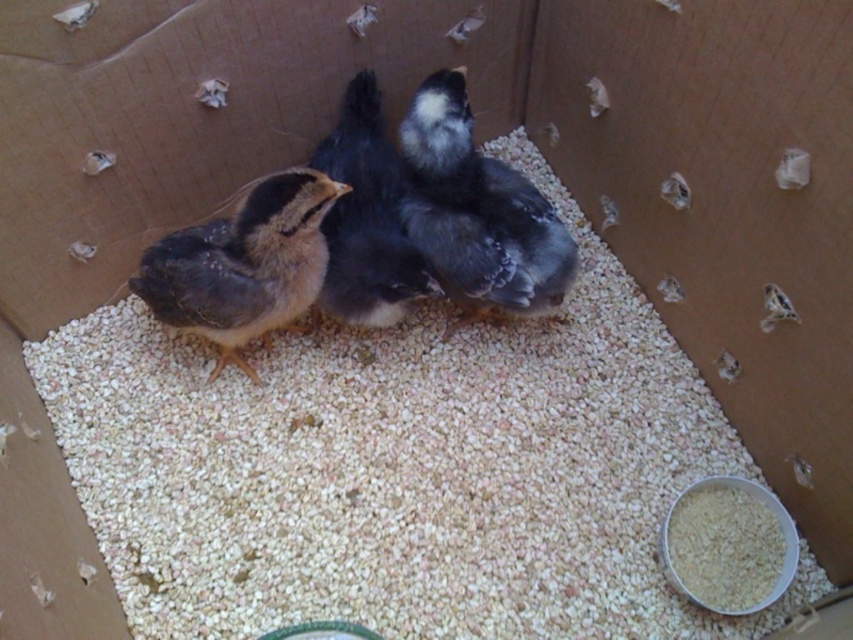
Who is higher up, silvery gray feathers at center or white grain at lower right?

Positioned higher is silvery gray feathers at center.

Which of these two, silvery gray feathers at center or white grain at lower right, stands shorter?

With less height is white grain at lower right.

Locate an element on the screen. This screenshot has width=853, height=640. silvery gray feathers at center is located at coordinates (479, 211).

The width and height of the screenshot is (853, 640). Find the location of `silvery gray feathers at center`. silvery gray feathers at center is located at coordinates (479, 211).

Can you confirm if soft yellow down at center is shorter than white grain at lower right?

In fact, soft yellow down at center may be taller than white grain at lower right.

In the scene shown: Can you confirm if soft yellow down at center is positioned above white grain at lower right?

Correct, soft yellow down at center is located above white grain at lower right.

This screenshot has width=853, height=640. Describe the element at coordinates (242, 264) in the screenshot. I see `soft yellow down at center` at that location.

You are a GUI agent. You are given a task and a screenshot of the screen. Output one action in this format:
    pyautogui.click(x=<x>, y=<y>)
    Task: Click on the soft yellow down at center
    This screenshot has height=640, width=853.
    Given the screenshot: What is the action you would take?
    pyautogui.click(x=242, y=264)

Is silvery gray feathers at center bigger than black feathered chick at center?

No.

Is silvery gray feathers at center positioned before black feathered chick at center?

Yes, silvery gray feathers at center is closer to the viewer.

Between point (463, 244) and point (376, 131), which one is positioned in front?

Point (463, 244) is more forward.

You are a GUI agent. You are given a task and a screenshot of the screen. Output one action in this format:
    pyautogui.click(x=<x>, y=<y>)
    Task: Click on the silvery gray feathers at center
    Image resolution: width=853 pixels, height=640 pixels.
    Given the screenshot: What is the action you would take?
    pyautogui.click(x=479, y=211)